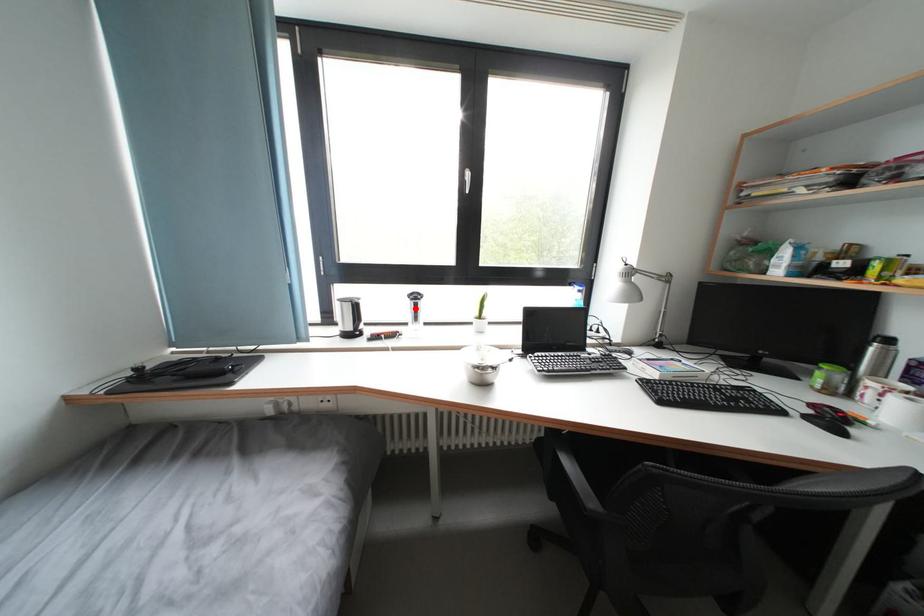
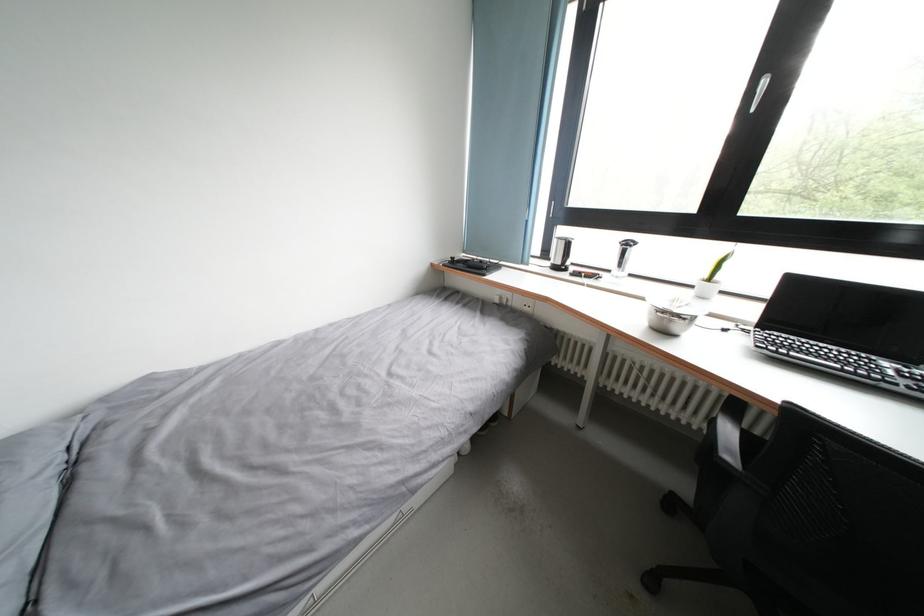
Find the pixel in the second image that matches the highlighted location in the first image.

(624, 254)